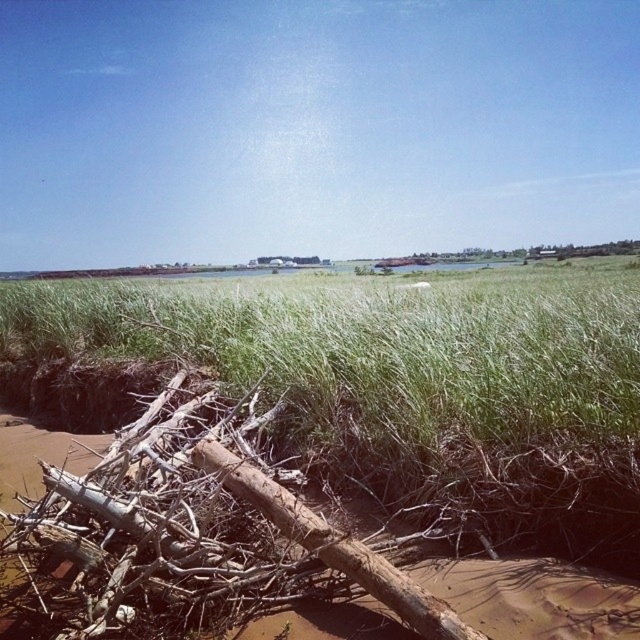
Question: Is green rough grass at center above brown rough wood at lower left?

Choices:
 (A) yes
 (B) no

Answer: (A)

Question: Which object is farther from the camera taking this photo?

Choices:
 (A) green rough grass at center
 (B) brown rough wood at lower left

Answer: (A)

Question: Which of the following is the farthest from the observer?

Choices:
 (A) (278, 280)
 (B) (196, 458)

Answer: (A)

Question: Is the position of green rough grass at center more distant than that of brown rough wood at lower left?

Choices:
 (A) yes
 (B) no

Answer: (A)

Question: Does green rough grass at center appear over brown rough wood at lower left?

Choices:
 (A) no
 (B) yes

Answer: (B)